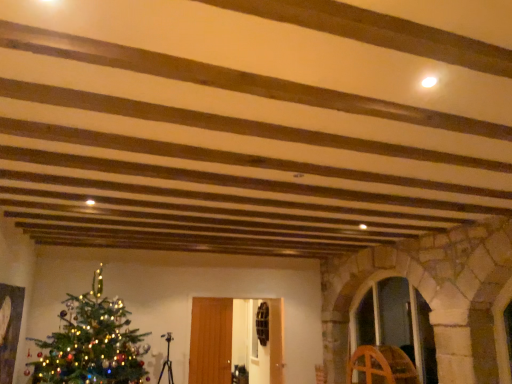
Question: From the image's perspective, would you say wooden wheel at right is shown under transparent glass door at center-right, acting as the 2th glass door starting from the left?

Choices:
 (A) no
 (B) yes

Answer: (B)

Question: Considering the relative sizes of wooden wheel at right and transparent glass door at center-right, acting as the 2th glass door starting from the left, in the image provided, is wooden wheel at right smaller than transparent glass door at center-right, acting as the 2th glass door starting from the left,?

Choices:
 (A) no
 (B) yes

Answer: (B)

Question: Considering the relative positions of wooden wheel at right and transparent glass door at center-right, acting as the 2th glass door starting from the left, in the image provided, is wooden wheel at right behind transparent glass door at center-right, acting as the 2th glass door starting from the left,?

Choices:
 (A) no
 (B) yes

Answer: (B)

Question: Could you tell me if wooden wheel at right is facing transparent glass door at center-right, which appears as the first glass door when viewed from the right?

Choices:
 (A) yes
 (B) no

Answer: (B)

Question: Is wooden wheel at right with transparent glass door at center-right, which appears as the first glass door when viewed from the right?

Choices:
 (A) yes
 (B) no

Answer: (B)

Question: Considering the relative sizes of wooden wheel at right and transparent glass door at center-right, which appears as the first glass door when viewed from the right, in the image provided, is wooden wheel at right thinner than transparent glass door at center-right, which appears as the first glass door when viewed from the right,?

Choices:
 (A) no
 (B) yes

Answer: (B)

Question: Is green matte christmas tree at lower left located outside wooden wheel at right?

Choices:
 (A) no
 (B) yes

Answer: (B)

Question: Does green matte christmas tree at lower left have a greater height compared to wooden wheel at right?

Choices:
 (A) no
 (B) yes

Answer: (B)

Question: Considering the relative sizes of green matte christmas tree at lower left and wooden wheel at right in the image provided, is green matte christmas tree at lower left shorter than wooden wheel at right?

Choices:
 (A) yes
 (B) no

Answer: (B)

Question: From the image's perspective, is green matte christmas tree at lower left below wooden wheel at right?

Choices:
 (A) no
 (B) yes

Answer: (A)

Question: Does green matte christmas tree at lower left lie in front of wooden wheel at right?

Choices:
 (A) no
 (B) yes

Answer: (B)

Question: Can you see green matte christmas tree at lower left touching wooden wheel at right?

Choices:
 (A) no
 (B) yes

Answer: (A)

Question: From the image's perspective, is transparent glass door at center, the first glass door viewed from the left, below wooden wheel at right?

Choices:
 (A) yes
 (B) no

Answer: (B)